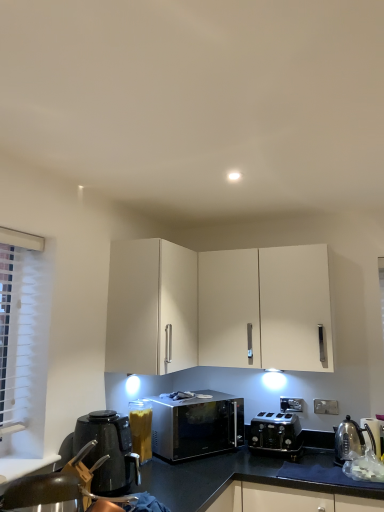
Looking at this image, measure the distance between white plastic electric outlet at lower right and camera.

white plastic electric outlet at lower right and camera are 8.51 feet apart from each other.

At what (x,y) coordinates should I click in order to perform the action: click on clear plastic container at center, which ranks as the 1th appliance in left-to-right order. Please return your answer as a coordinate pair (x, y). The height and width of the screenshot is (512, 384). Looking at the image, I should click on (141, 429).

Consider the image. What is the approximate width of clear plastic container at center, which ranks as the 1th appliance in left-to-right order?

clear plastic container at center, which ranks as the 1th appliance in left-to-right order, is 5.90 inches wide.

Image resolution: width=384 pixels, height=512 pixels. Describe the element at coordinates (373, 432) in the screenshot. I see `metallic silver kettle at right, which is the 1th appliance from right to left` at that location.

Describe the element at coordinates (108, 450) in the screenshot. I see `black plastic kettle at lower left` at that location.

The image size is (384, 512). Describe the element at coordinates (196, 425) in the screenshot. I see `sleek metallic microwave at center` at that location.

Where is `white plastic electric outlet at lower right`? This screenshot has width=384, height=512. white plastic electric outlet at lower right is located at coordinates (326, 407).

Does white plastic electric outlet at lower right contain black plastic kettle at lower left?

No, black plastic kettle at lower left is located outside of white plastic electric outlet at lower right.

From the image's perspective, is white plastic electric outlet at lower right positioned above or below black plastic kettle at lower left?

From the image's perspective, white plastic electric outlet at lower right appears below black plastic kettle at lower left.

Between white plastic electric outlet at lower right and black plastic kettle at lower left, which one has smaller size?

white plastic electric outlet at lower right is smaller.

From a real-world perspective, is metallic silver swivel chair at lower left located higher than white plastic electric outlet at lower right?

Actually, metallic silver swivel chair at lower left is physically below white plastic electric outlet at lower right in the real world.

Which is closer to the camera, (95, 498) or (335, 401)?

Point (95, 498) is closer to the camera than point (335, 401).

From the image's perspective, would you say metallic silver swivel chair at lower left is shown under white plastic electric outlet at lower right?

Actually, metallic silver swivel chair at lower left appears above white plastic electric outlet at lower right in the image.

Between metallic silver swivel chair at lower left and white plastic electric outlet at lower right, which one has more height?

metallic silver swivel chair at lower left.

Considering the relative sizes of white matte cabinet at upper center and metallic silver swivel chair at lower left in the image provided, is white matte cabinet at upper center taller than metallic silver swivel chair at lower left?

Correct, white matte cabinet at upper center is much taller as metallic silver swivel chair at lower left.

From a real-world perspective, who is located lower, white matte cabinet at upper center or metallic silver swivel chair at lower left?

metallic silver swivel chair at lower left is physically lower.

Is white matte cabinet at upper center with metallic silver swivel chair at lower left?

No, white matte cabinet at upper center is not with metallic silver swivel chair at lower left.

Is white matte cabinet at upper center aimed at metallic silver swivel chair at lower left?

No, white matte cabinet at upper center is not oriented towards metallic silver swivel chair at lower left.

How different are the orientations of metallic silver kettle at right, which appears as the 3th appliance when viewed from the left, and black plastic kettle at lower left in degrees?

They differ by 113 degrees in their facing directions.

Which of these two, metallic silver kettle at right, which is the 1th appliance from right to left, or black plastic kettle at lower left, is wider?

Wider between the two is black plastic kettle at lower left.

Which object is positioned more to the left, metallic silver kettle at right, which appears as the 3th appliance when viewed from the left, or black plastic kettle at lower left?

From the viewer's perspective, black plastic kettle at lower left appears more on the left side.

Find the location of `kitchen appliance above the metallic silver kettle at right, which appears as the 3th appliance when viewed from the left (from a real-world perspective)`. kitchen appliance above the metallic silver kettle at right, which appears as the 3th appliance when viewed from the left (from a real-world perspective) is located at coordinates (108, 450).

From a real-world perspective, does sleek metallic microwave at center sit lower than white plastic electric outlet at lower right?

Yes, from a real-world perspective, sleek metallic microwave at center is beneath white plastic electric outlet at lower right.

Is sleek metallic microwave at center aimed at white plastic electric outlet at lower right?

No.

Is sleek metallic microwave at center inside the boundaries of white plastic electric outlet at lower right, or outside?

sleek metallic microwave at center exists outside the volume of white plastic electric outlet at lower right.

Is black metallic toaster at lower center in front of or behind white plastic electric outlet at lower right in the image?

black metallic toaster at lower center is in front of white plastic electric outlet at lower right.

Considering the relative sizes of black metallic toaster at lower center and white plastic electric outlet at lower right in the image provided, is black metallic toaster at lower center smaller than white plastic electric outlet at lower right?

Actually, black metallic toaster at lower center might be larger than white plastic electric outlet at lower right.

What's the angular difference between black metallic toaster at lower center and white plastic electric outlet at lower right's facing directions?

black metallic toaster at lower center and white plastic electric outlet at lower right are facing 0.828 degrees away from each other.

Considering the positions of objects black metallic toaster at lower center and white plastic electric outlet at lower right in the image provided, who is more to the right, black metallic toaster at lower center or white plastic electric outlet at lower right?

From the viewer's perspective, white plastic electric outlet at lower right appears more on the right side.

Measure the distance from white plastic electric outlet at lower right to white matte cabinet at upper center.

A distance of 3.85 feet exists between white plastic electric outlet at lower right and white matte cabinet at upper center.

At what (x,y) coordinates should I click in order to perform the action: click on electric outlet that is under the white matte cabinet at upper center (from a real-world perspective). Please return your answer as a coordinate pair (x, y). Looking at the image, I should click on (326, 407).

Does white plastic electric outlet at lower right turn towards white matte cabinet at upper center?

No.

From a real-world perspective, is white plastic electric outlet at lower right positioned under white matte cabinet at upper center based on gravity?

Yes.

Where is `kitchen appliance beneath the white plastic electric outlet at lower right (from a real-world perspective)`? kitchen appliance beneath the white plastic electric outlet at lower right (from a real-world perspective) is located at coordinates (108, 450).

This screenshot has width=384, height=512. I want to click on swivel chair in front of the white plastic electric outlet at lower right, so click(61, 487).

From the image, which object appears to be farther from clear plastic container at center, which ranks as the 1th appliance in left-to-right order, black plastic kettle at lower left or polished stainless steel kettle at lower right, arranged as the 2th appliance when viewed from the right?

polished stainless steel kettle at lower right, arranged as the 2th appliance when viewed from the right, is further to clear plastic container at center, which ranks as the 1th appliance in left-to-right order.

Consider the image. Considering their positions, is sleek metallic microwave at center positioned further to metallic silver kettle at right, which appears as the 3th appliance when viewed from the left, than polished stainless steel kettle at lower right, which is the 2th appliance in left-to-right order?

sleek metallic microwave at center.

Based on their spatial positions, is white matte cabinet at upper center or metallic silver kettle at right, which is the 1th appliance from right to left, further from sleek metallic microwave at center?

The object further to sleek metallic microwave at center is metallic silver kettle at right, which is the 1th appliance from right to left.

Estimate the real-world distances between objects in this image. Which object is further from black metallic toaster at lower center, polished stainless steel kettle at lower right, which is the 2th appliance in left-to-right order, or metallic silver swivel chair at lower left?

metallic silver swivel chair at lower left.

Estimate the real-world distances between objects in this image. Which object is further from metallic silver swivel chair at lower left, white plastic electric outlet at lower right or sleek metallic microwave at center?

Based on the image, white plastic electric outlet at lower right appears to be further to metallic silver swivel chair at lower left.

Which object lies nearer to the anchor point metallic silver swivel chair at lower left, white matte cabinet at upper center or sleek metallic microwave at center?

The object closer to metallic silver swivel chair at lower left is white matte cabinet at upper center.

Looking at the image, which one is located closer to metallic silver kettle at right, which appears as the 3th appliance when viewed from the left, black plastic kettle at lower left or clear plastic container at center, which ranks as the 1th appliance in left-to-right order?

clear plastic container at center, which ranks as the 1th appliance in left-to-right order, is positioned closer to the anchor metallic silver kettle at right, which appears as the 3th appliance when viewed from the left.

Based on the photo, when comparing their distances from white matte cabinet at upper center, does black plastic kettle at lower left or sleek metallic microwave at center seem further?

Answer: The object further to white matte cabinet at upper center is black plastic kettle at lower left.

You are a GUI agent. You are given a task and a screenshot of the screen. Output one action in this format:
    pyautogui.click(x=<x>, y=<y>)
    Task: Click on the kitchen appliance located between metallic silver swivel chair at lower left and polished stainless steel kettle at lower right, which is the 2th appliance in left-to-right order, in the left-right direction
    The width and height of the screenshot is (384, 512).
    Given the screenshot: What is the action you would take?
    pyautogui.click(x=108, y=450)

Locate an element on the screen. toaster situated between black plastic kettle at lower left and metallic silver kettle at right, which is the 1th appliance from right to left, from left to right is located at coordinates (276, 434).

Image resolution: width=384 pixels, height=512 pixels. I want to click on electric outlet between white matte cabinet at upper center and metallic silver kettle at right, which is the 1th appliance from right to left, in the horizontal direction, so click(326, 407).

Where is `appliance situated between sleek metallic microwave at center and metallic silver kettle at right, which appears as the 3th appliance when viewed from the left, from left to right`? The height and width of the screenshot is (512, 384). appliance situated between sleek metallic microwave at center and metallic silver kettle at right, which appears as the 3th appliance when viewed from the left, from left to right is located at coordinates (349, 439).